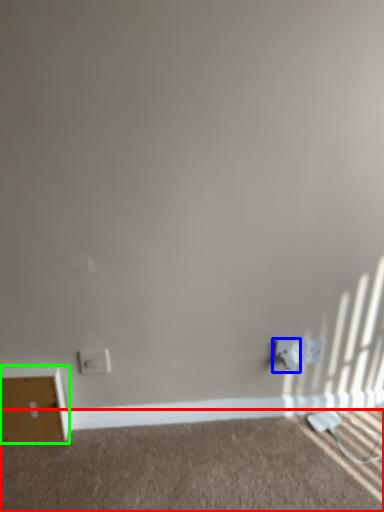
Question: Considering the real-world distances, which object is closest to plain (highlighted by a red box)? electric outlet (highlighted by a blue box) or file cabinet (highlighted by a green box).

Choices:
 (A) electric outlet
 (B) file cabinet

Answer: (B)